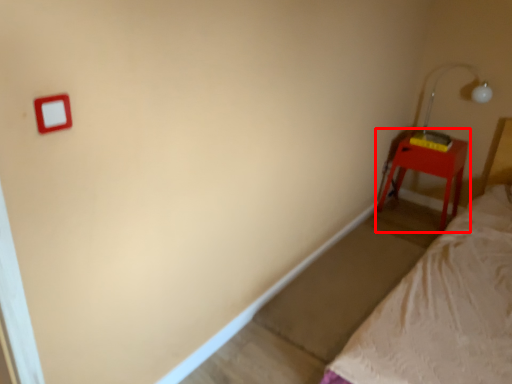
Question: Considering the relative positions of nightstand (annotated by the red box) and lamp in the image provided, where is nightstand (annotated by the red box) located with respect to the staircase?

Choices:
 (A) right
 (B) left

Answer: (B)